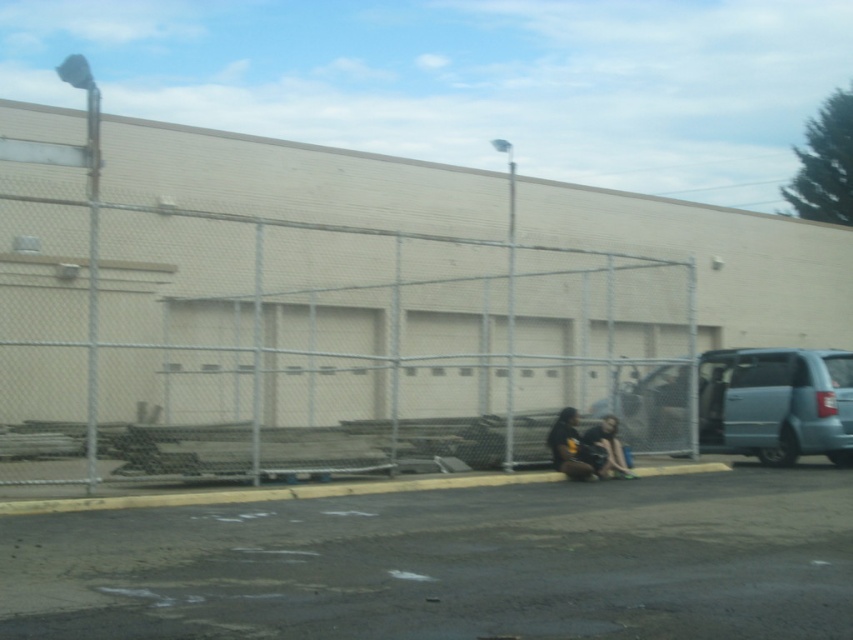
Who is positioned more to the right, black matte shirt at center or dark gray fabric squat at lower right?

dark gray fabric squat at lower right

Who is more distant from viewer, (553, 465) or (582, 440)?

The point (553, 465) is more distant.

Where is `black matte shirt at center`? Image resolution: width=853 pixels, height=640 pixels. black matte shirt at center is located at coordinates (570, 448).

Is the position of metallic chain-link fence at center less distant than that of gray concrete curb at lower center?

No, metallic chain-link fence at center is further to the viewer.

Does metallic chain-link fence at center have a larger size compared to gray concrete curb at lower center?

Indeed, metallic chain-link fence at center has a larger size compared to gray concrete curb at lower center.

Is point (128, 477) positioned after point (705, 468)?

No, it is not.

Where is `metallic chain-link fence at center`? This screenshot has height=640, width=853. metallic chain-link fence at center is located at coordinates (309, 342).

Who is higher up, gray concrete curb at lower center or dark gray fabric squat at lower right?

dark gray fabric squat at lower right is above.

How much distance is there between gray concrete curb at lower center and dark gray fabric squat at lower right?

gray concrete curb at lower center is 3.85 feet from dark gray fabric squat at lower right.

Does point (642, 467) come closer to viewer compared to point (593, 429)?

No.

Find the location of a particular element. gray concrete curb at lower center is located at coordinates (270, 492).